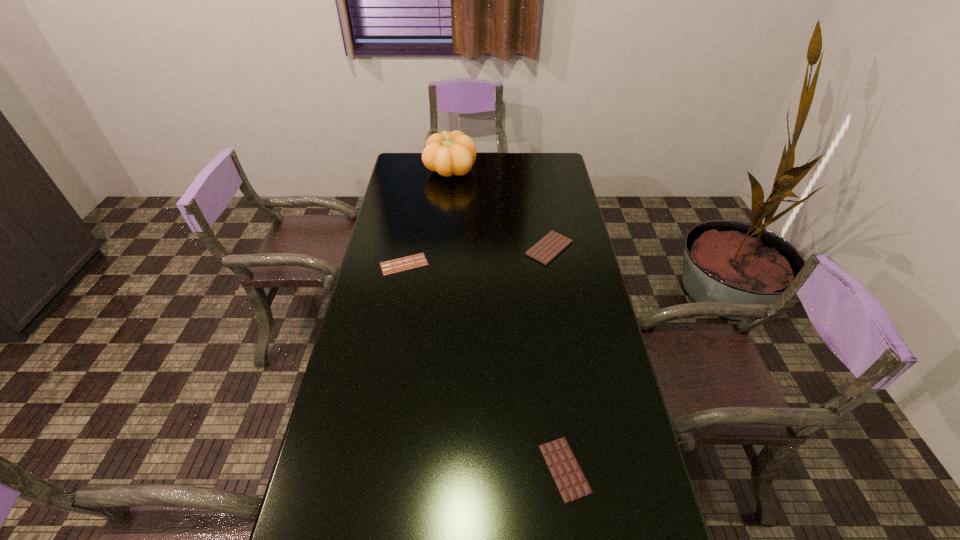
Where is `empty location between the farthest object and the leftmost chocolate bar`? This screenshot has height=540, width=960. empty location between the farthest object and the leftmost chocolate bar is located at coordinates (427, 218).

At what (x,y) coordinates should I click in order to perform the action: click on unoccupied position between the pumpkin and the second tallest object. Please return your answer as a coordinate pair (x, y). This screenshot has width=960, height=540. Looking at the image, I should click on (500, 210).

Where is `free spot between the nearest object and the leftmost chocolate bar`? The width and height of the screenshot is (960, 540). free spot between the nearest object and the leftmost chocolate bar is located at coordinates (485, 367).

You are a GUI agent. You are given a task and a screenshot of the screen. Output one action in this format:
    pyautogui.click(x=<x>, y=<y>)
    Task: Click on the vacant area between the second tallest object and the leftmost chocolate bar
    Image resolution: width=960 pixels, height=540 pixels.
    Given the screenshot: What is the action you would take?
    pyautogui.click(x=477, y=256)

At what (x,y) coordinates should I click in order to perform the action: click on free space between the nearest object and the tallest chocolate bar. Please return your answer as a coordinate pair (x, y). The width and height of the screenshot is (960, 540). Looking at the image, I should click on (557, 359).

I want to click on vacant area that lies between the farthest object and the nearest object, so click(x=508, y=320).

Identify the location of vacant region between the leftmost chocolate bar and the tallest chocolate bar. This screenshot has width=960, height=540. (477, 256).

What are the coordinates of `object that ranks as the closest to the leftmost chocolate bar` in the screenshot? It's located at (549, 247).

Where is `object that stands as the closest to the nearest chocolate bar`? object that stands as the closest to the nearest chocolate bar is located at coordinates (549, 247).

Identify which chocolate bar is the nearest to the tallest chocolate bar. Please provide its 2D coordinates. Your answer should be formatted as a tuple, i.e. [(x, y)], where the tuple contains the x and y coordinates of a point satisfying the conditions above.

[(418, 260)]